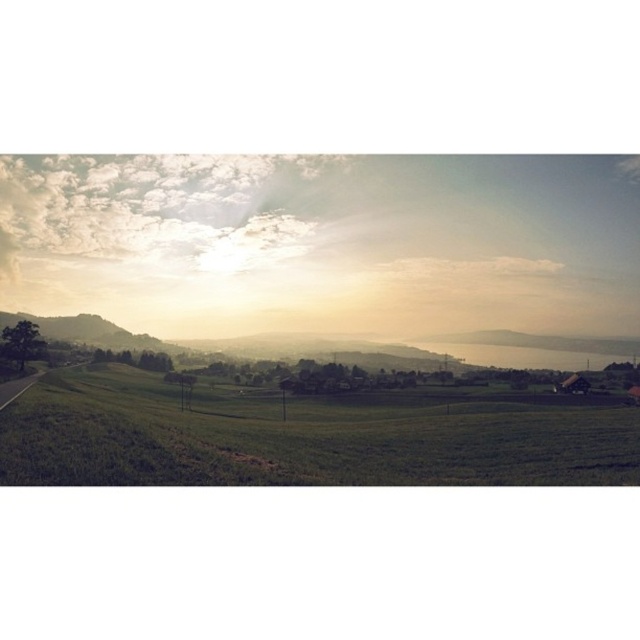
You are a hiker standing on the green grassy field at lower left and want to reach the golden haze landscape at center. Which direction should you head towards?

The green grassy field at lower left is positioned under the golden haze landscape at center, so you should head upwards to reach the golden haze landscape at center.

Consider the image. You are standing at the edge of the golden haze landscape at center and want to walk to the green grassy field at lower left. Which direction should you face to head towards it?

You should face to the left to head towards the green grassy field at lower left since it is located to the left of the golden haze landscape at center.